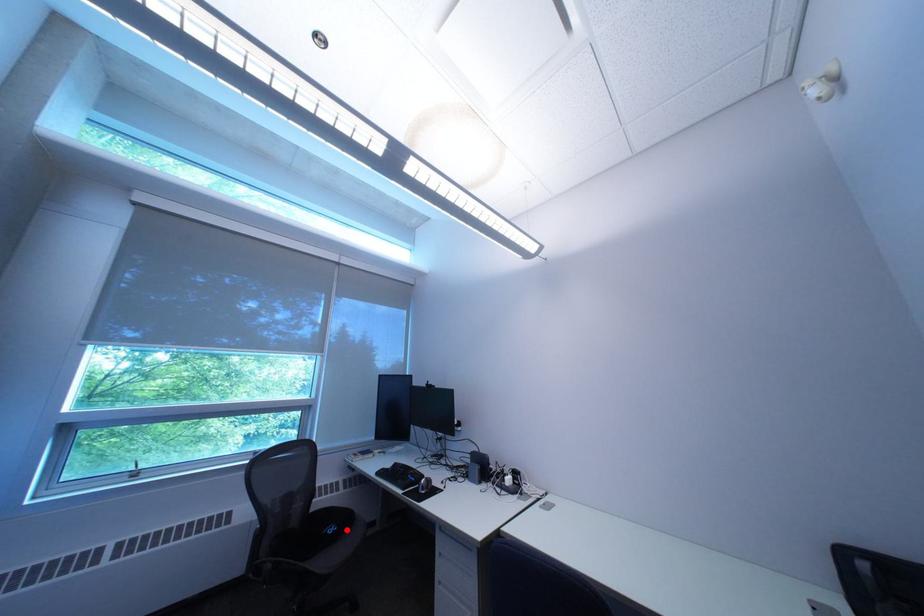
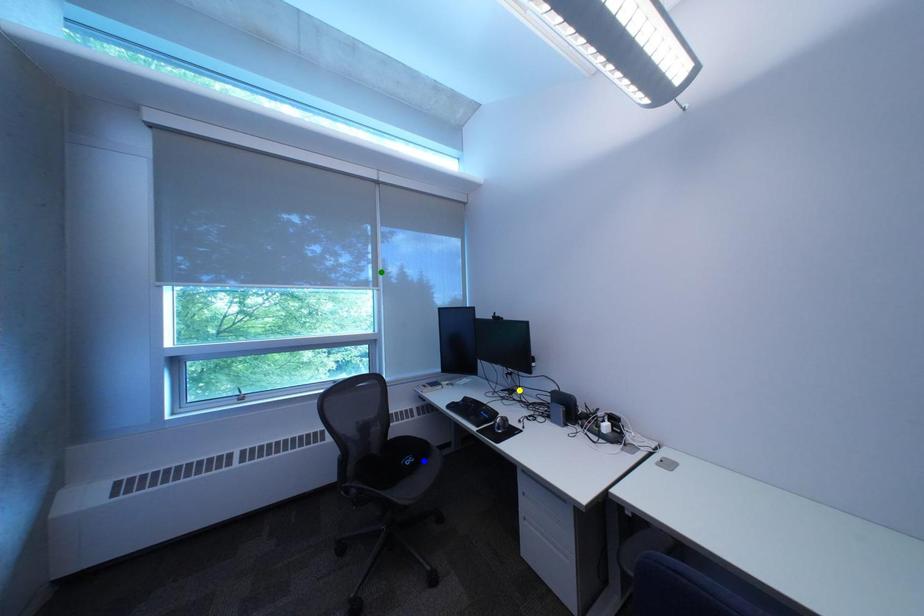
Question: I am providing you with two images of the same scene from different viewpoints. A red point is marked on the first image. You are given multiple points on the second image. Which point in image 2 is actually the same real-world point as the red point in image 1?

Choices:
 (A) yellow point
 (B) blue point
 (C) green point

Answer: (B)